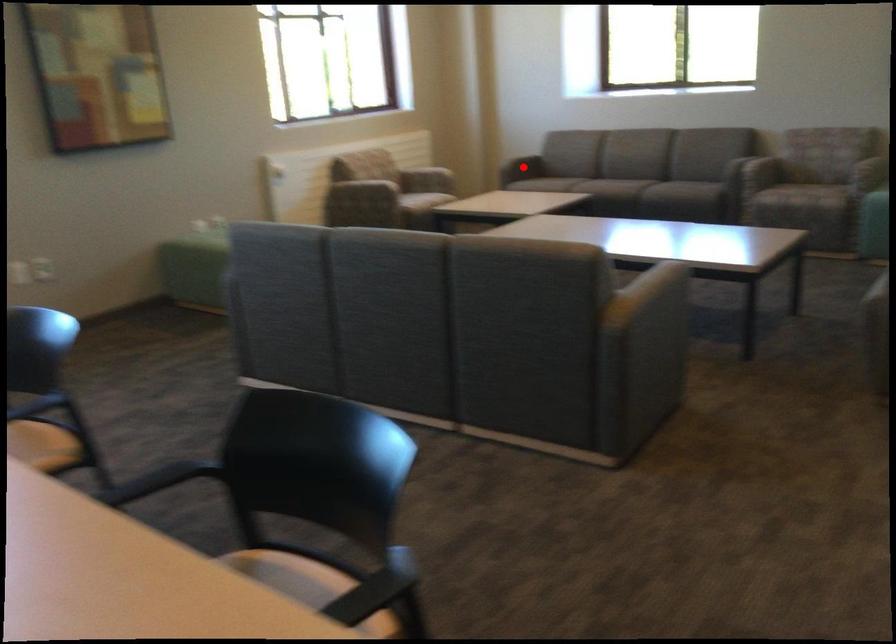
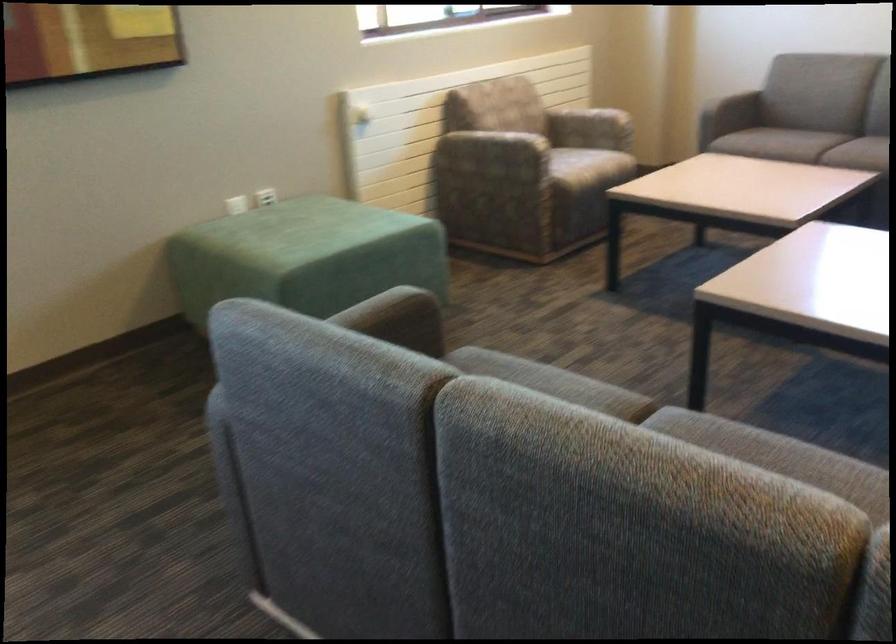
Question: I am providing you with two images of the same scene from different viewpoints. A red point is marked on the first image. At the location where the point appears in image 1, is it still visible in image 2?

Choices:
 (A) Yes
 (B) No

Answer: (B)